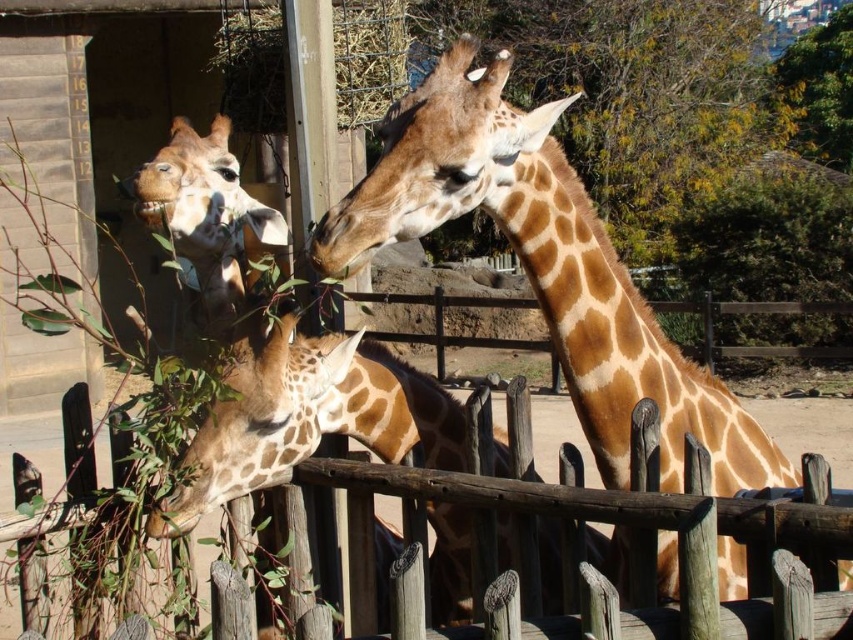
Describe the element at coordinates (544, 266) in the screenshot. Image resolution: width=853 pixels, height=640 pixels. I see `brown spotted giraffe at upper center` at that location.

The height and width of the screenshot is (640, 853). What do you see at coordinates (544, 266) in the screenshot?
I see `brown spotted giraffe at upper center` at bounding box center [544, 266].

The image size is (853, 640). Identify the location of brown spotted giraffe at upper center. (544, 266).

How much distance is there between green leafy tree at upper center and wooden fence at lower center?

A distance of 7.66 meters exists between green leafy tree at upper center and wooden fence at lower center.

Which is behind, point (645, 140) or point (538, 435)?

Positioned behind is point (645, 140).

Between point (693, 33) and point (9, 621), which one is positioned behind?

Point (693, 33)

At what (x,y) coordinates should I click in order to perform the action: click on green leafy tree at upper center. Please return your answer as a coordinate pair (x, y). Looking at the image, I should click on (630, 93).

Is brown spotted giraffe at upper left positioned before yellow-green leaves at upper right?

Yes, it is.

Between point (285, 241) and point (775, 132), which one is positioned in front?

Point (285, 241) is more forward.

This screenshot has height=640, width=853. In order to click on brown spotted giraffe at upper left in this screenshot , I will do `click(206, 212)`.